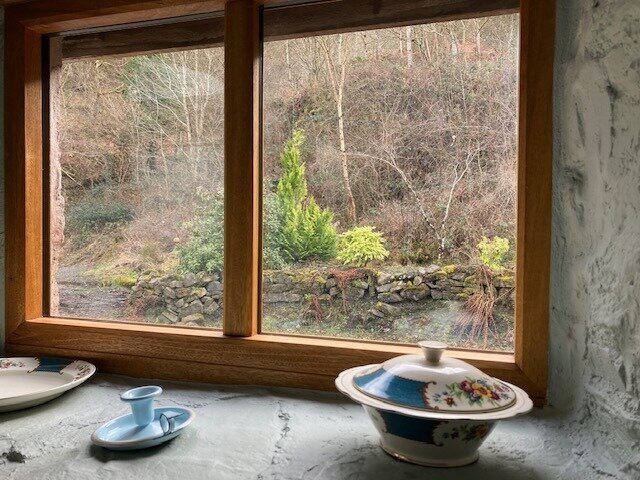
Find the location of `3 pottery pieces on windowsill`. 3 pottery pieces on windowsill is located at coordinates (x=438, y=425), (x=152, y=413), (x=22, y=383).